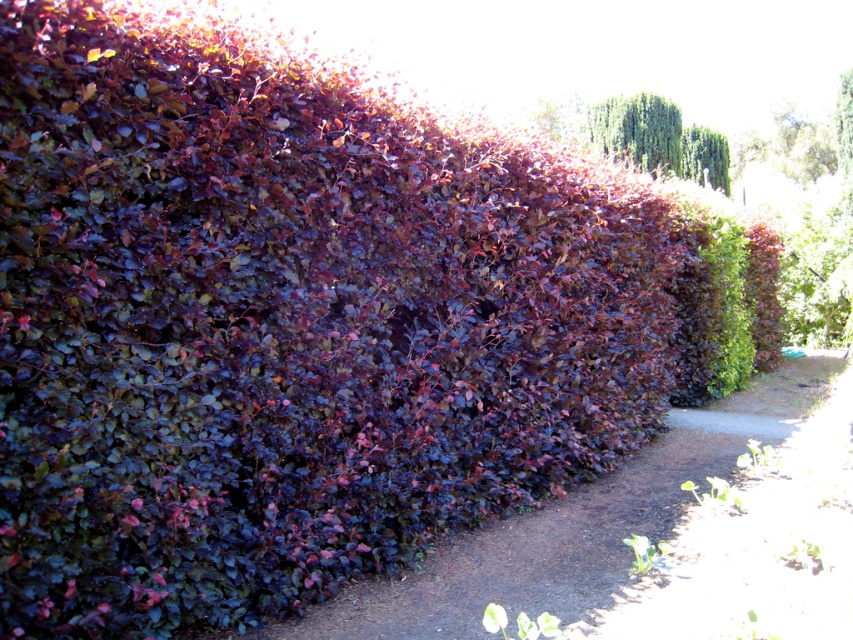
You are standing on the dirt path and want to reach the green leafy plant at lower right. Which direction should you walk to get closer to it without going through the purple leafy hedge at center?

You should walk to the right side of the purple leafy hedge at center to reach the green leafy plant at lower right, as the purple leafy hedge at center is positioned on the left side of the green leafy plant at lower right.

You are standing on the dirt path to the right of the purple leafy hedge at center and the green textured tree at upper center. Which object is nearer to you?

The purple leafy hedge at center is closer to the viewer than the green textured tree at upper center, so the purple leafy hedge at center is nearer to you.